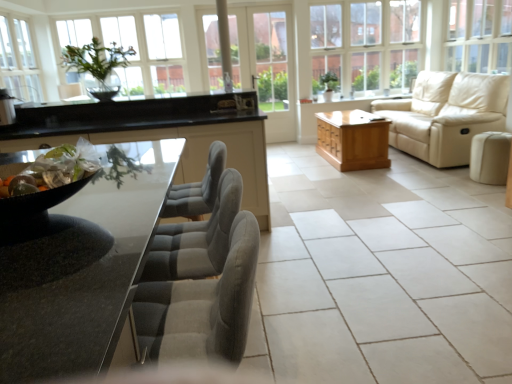
Question: Is beige leather couch at right thinner than clear glass window at upper center, the second window positioned from the right?

Choices:
 (A) no
 (B) yes

Answer: (A)

Question: From the image's perspective, is beige leather couch at right under clear glass window at upper center, arranged as the 2th window when viewed from the left?

Choices:
 (A) no
 (B) yes

Answer: (B)

Question: Considering the relative sizes of beige leather couch at right and clear glass window at upper center, the second window positioned from the right, in the image provided, is beige leather couch at right smaller than clear glass window at upper center, the second window positioned from the right,?

Choices:
 (A) no
 (B) yes

Answer: (A)

Question: Considering the relative sizes of beige leather couch at right and clear glass window at upper center, the second window positioned from the right, in the image provided, is beige leather couch at right wider than clear glass window at upper center, the second window positioned from the right,?

Choices:
 (A) yes
 (B) no

Answer: (A)

Question: Is beige leather couch at right in front of clear glass window at upper center, arranged as the 2th window when viewed from the left?

Choices:
 (A) yes
 (B) no

Answer: (A)

Question: From their relative heights in the image, would you say beige leather couch at right is taller or shorter than white ceramic tile at center?

Choices:
 (A) short
 (B) tall

Answer: (B)

Question: Which is correct: beige leather couch at right is inside white ceramic tile at center, or outside of it?

Choices:
 (A) outside
 (B) inside

Answer: (A)

Question: From the image's perspective, is beige leather couch at right positioned above or below white ceramic tile at center?

Choices:
 (A) above
 (B) below

Answer: (A)

Question: Is beige leather couch at right bigger or smaller than white ceramic tile at center?

Choices:
 (A) small
 (B) big

Answer: (B)

Question: In the image, is shiny metallic bowl at left, the 2th food positioned from the back, positioned in front of or behind clear glass vase at upper center, placed as the third window when sorted from right to left?

Choices:
 (A) behind
 (B) front

Answer: (B)

Question: Considering the positions of shiny metallic bowl at left, the 2th food positioned from the back, and clear glass vase at upper center, placed as the third window when sorted from right to left, in the image, is shiny metallic bowl at left, the 2th food positioned from the back, wider or thinner than clear glass vase at upper center, placed as the third window when sorted from right to left,?

Choices:
 (A) wide
 (B) thin

Answer: (B)

Question: In terms of size, does shiny metallic bowl at left, the first food from the front, appear bigger or smaller than clear glass vase at upper center, placed as the third window when sorted from right to left?

Choices:
 (A) big
 (B) small

Answer: (B)

Question: Would you say shiny metallic bowl at left, the 2th food positioned from the back, is to the left or to the right of clear glass vase at upper center, marked as the first window in a left-to-right arrangement, in the picture?

Choices:
 (A) right
 (B) left

Answer: (A)

Question: Is velvet grey chair at center inside or outside of clear glass window at upper right, placed as the 1th window when sorted from right to left?

Choices:
 (A) inside
 (B) outside

Answer: (B)

Question: Would you say velvet grey chair at center is to the left or to the right of clear glass window at upper right, the third window from the left, in the picture?

Choices:
 (A) right
 (B) left

Answer: (B)